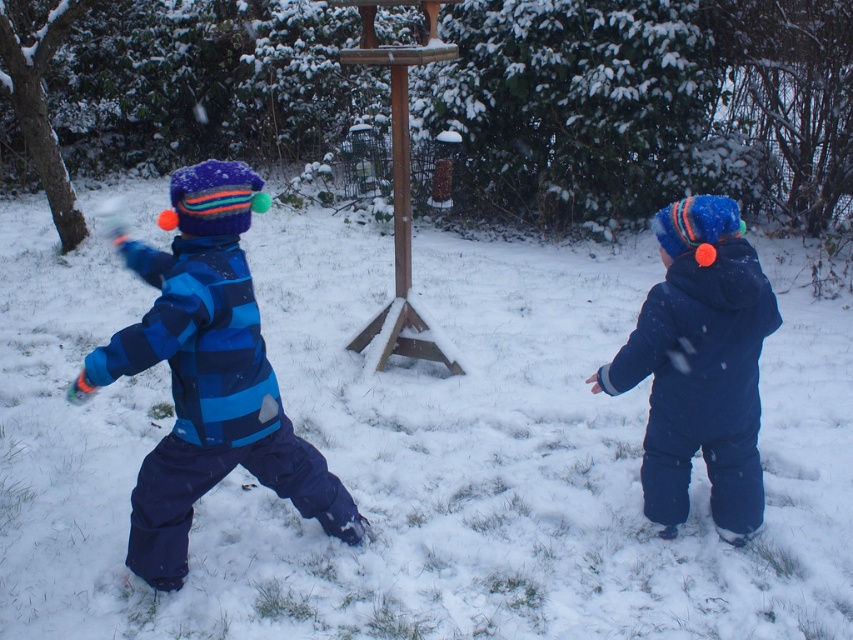
You are a parent looking for your children in the snowy scene. You see the blue striped snowsuit at left and the matte blue snowsuit at right. Which child is farther to the left?

The blue striped snowsuit at left is farther to the left than the matte blue snowsuit at right.

You are a parent trying to ensure your children are spaced safely apart while playing in the snow. The recommended safe distance is 2 meters. Are the children wearing blue striped snowsuit at left and matte blue snowsuit at right following the safety guidelines?

The distance between blue striped snowsuit at left and matte blue snowsuit at right is 1.81 meters, which is less than the recommended 2 meters. Therefore, they are not following the safety guidelines.